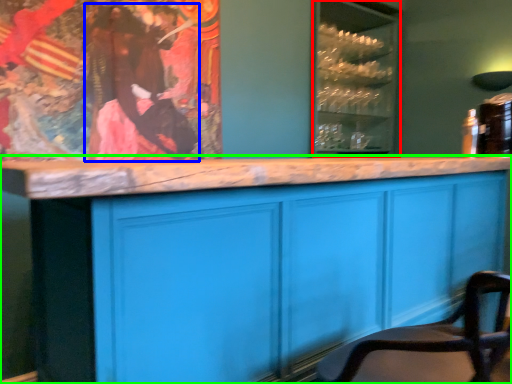
Question: Based on their relative distances, which object is nearer to glass door (highlighted by a red box)? Choose from person (highlighted by a blue box) and cabinetry (highlighted by a green box).

Choices:
 (A) person
 (B) cabinetry

Answer: (A)